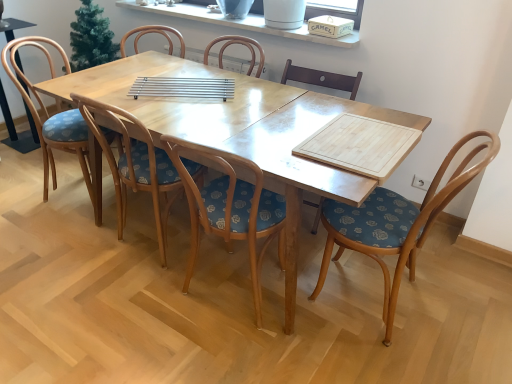
Find the location of a particular element. vacant region below woodenwoodenchair at right, which is counted as the fifth chair, starting from the left (from a real-world perspective) is located at coordinates (395, 309).